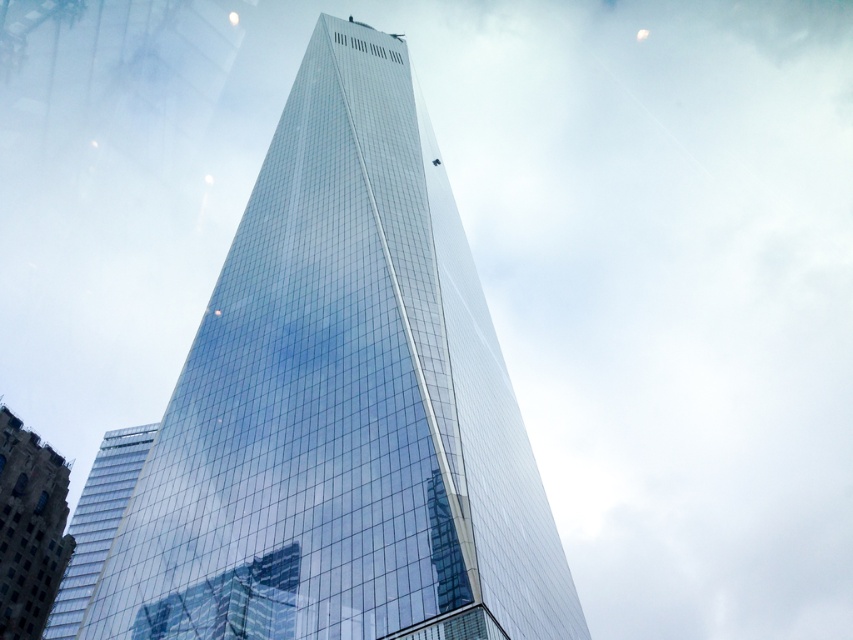
Question: Does transparent glass tower at center lie in front of glassy reflective building at lower left?

Choices:
 (A) no
 (B) yes

Answer: (B)

Question: Is transparent glass tower at center further to camera compared to glassy reflective building at lower left?

Choices:
 (A) yes
 (B) no

Answer: (B)

Question: Which point appears farthest from the camera in this image?

Choices:
 (A) (20, 637)
 (B) (323, 499)

Answer: (A)

Question: Does transparent glass tower at center appear over glassy reflective building at lower left?

Choices:
 (A) yes
 (B) no

Answer: (A)

Question: Which object appears closest to the camera in this image?

Choices:
 (A) transparent glass tower at center
 (B) glassy reflective building at lower left

Answer: (A)

Question: Which point is farther to the camera?

Choices:
 (A) (413, 211)
 (B) (36, 477)

Answer: (B)